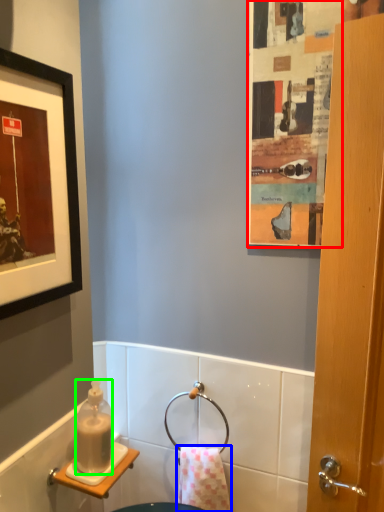
Question: Which object is the farthest from poster (highlighted by a red box)? Choose among these: towel/napkin (highlighted by a blue box) or bottle (highlighted by a green box).

Choices:
 (A) towel/napkin
 (B) bottle

Answer: (A)